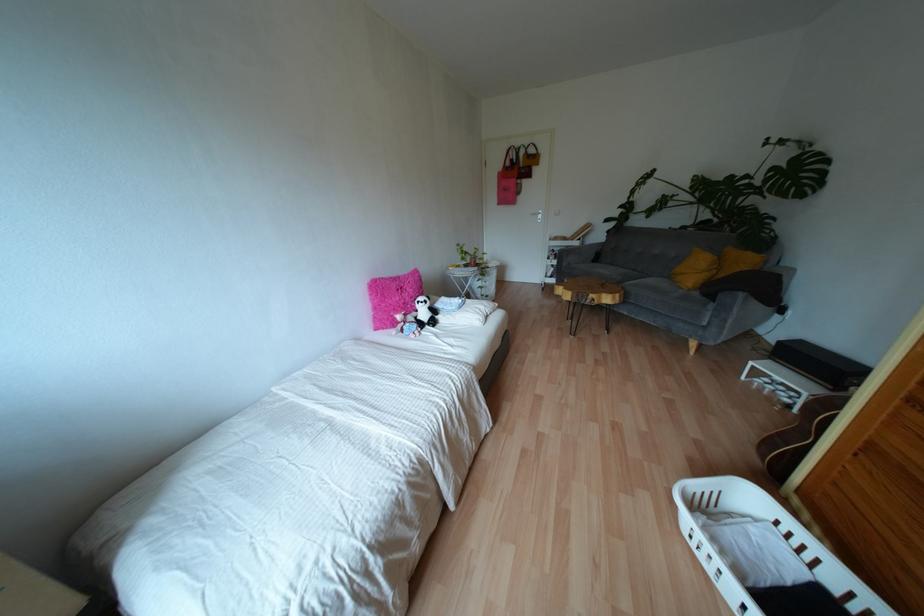
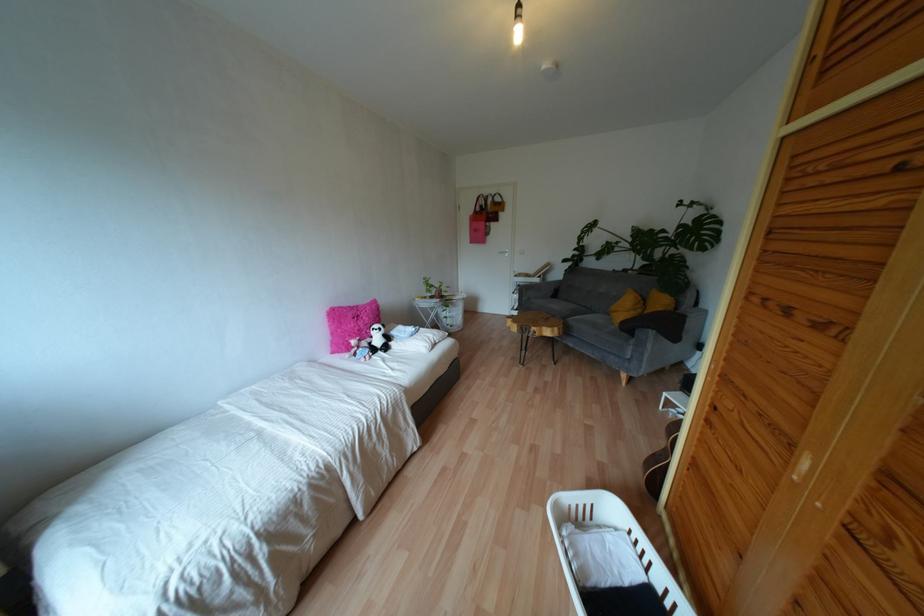
Where in the second image is the point corresponding to point (427, 326) from the first image?

(379, 352)